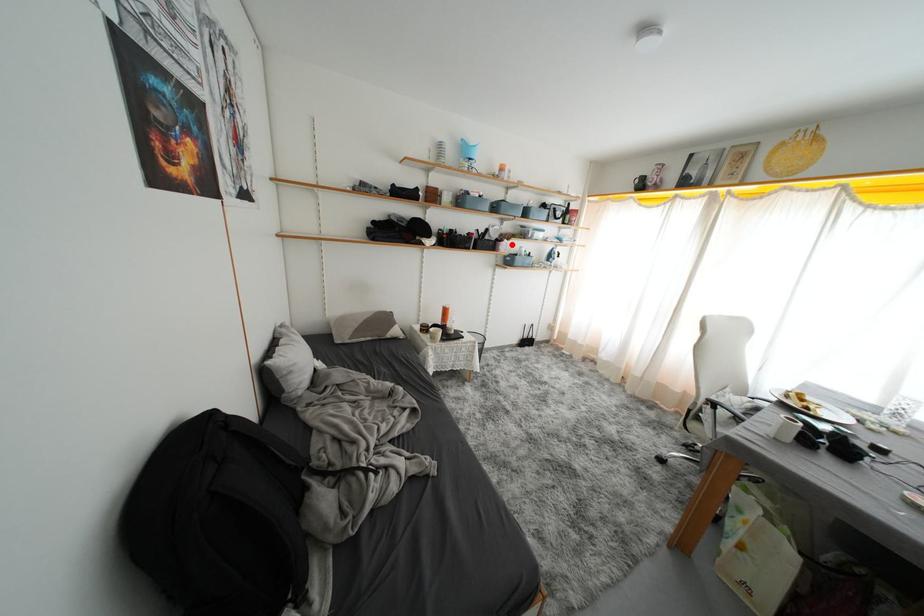
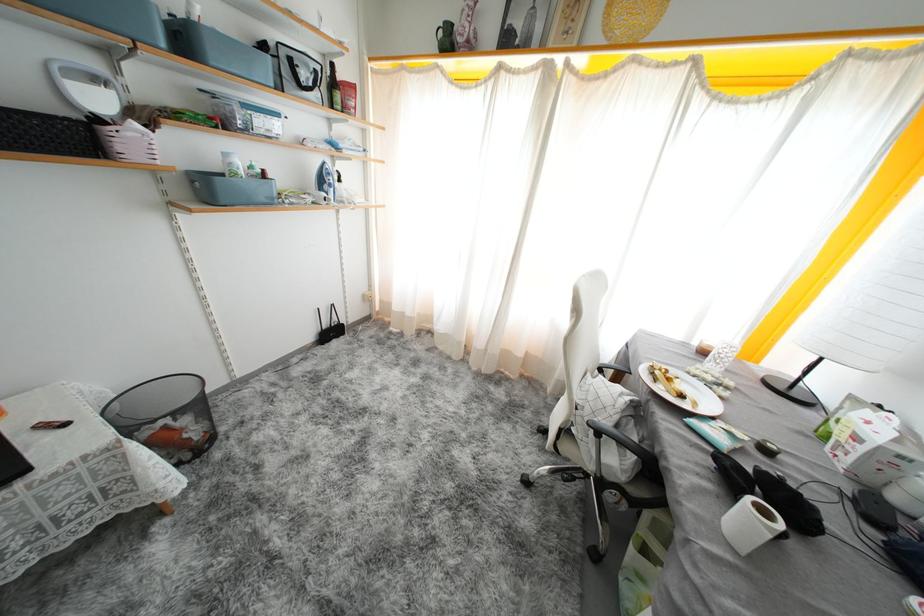
Find the pixel in the second image that matches the highlighted location in the first image.

(141, 129)